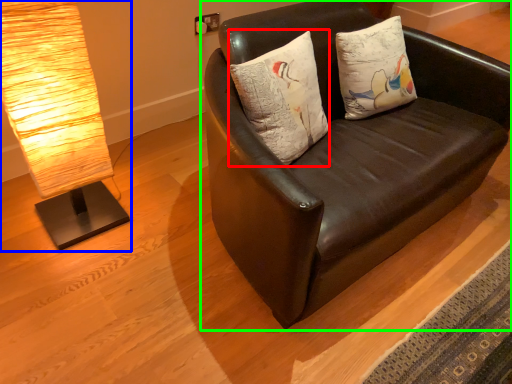
Question: Which object is the closest to the pillow (highlighted by a red box)? Choose among these: lamp (highlighted by a blue box) or studio couch (highlighted by a green box).

Choices:
 (A) lamp
 (B) studio couch

Answer: (B)